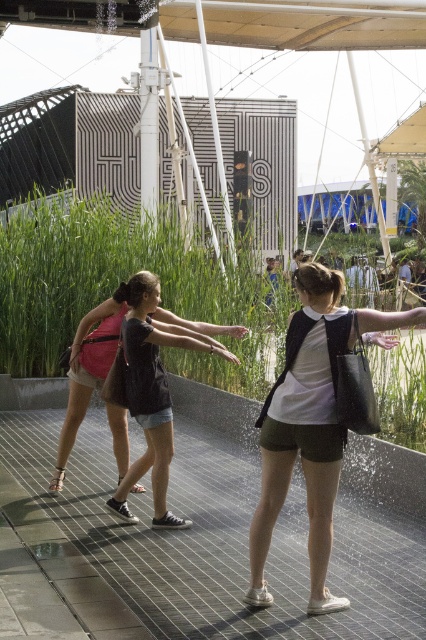
Question: Does matte black tote bag at center appear on the left side of black matte t-shirt at center?

Choices:
 (A) yes
 (B) no

Answer: (B)

Question: Is matte black tote bag at center behind black matte t-shirt at center?

Choices:
 (A) yes
 (B) no

Answer: (B)

Question: Which object appears closest to the camera in this image?

Choices:
 (A) matte black tote bag at center
 (B) black matte t-shirt at center

Answer: (A)

Question: Does matte black tote bag at center appear over black matte t-shirt at center?

Choices:
 (A) no
 (B) yes

Answer: (A)

Question: Which point is farther to the camera?

Choices:
 (A) matte black tote bag at center
 (B) black matte t-shirt at center

Answer: (B)